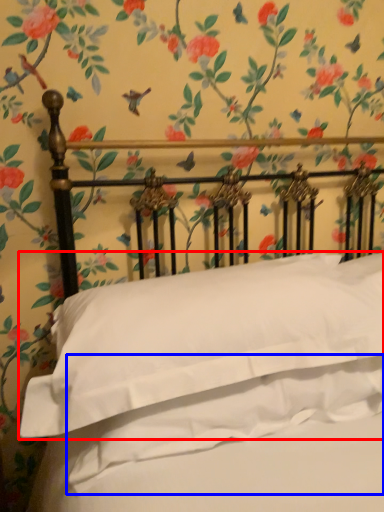
Question: Which point is further to the camera, pillow (highlighted by a red box) or sheet (highlighted by a blue box)?

Choices:
 (A) pillow
 (B) sheet

Answer: (B)